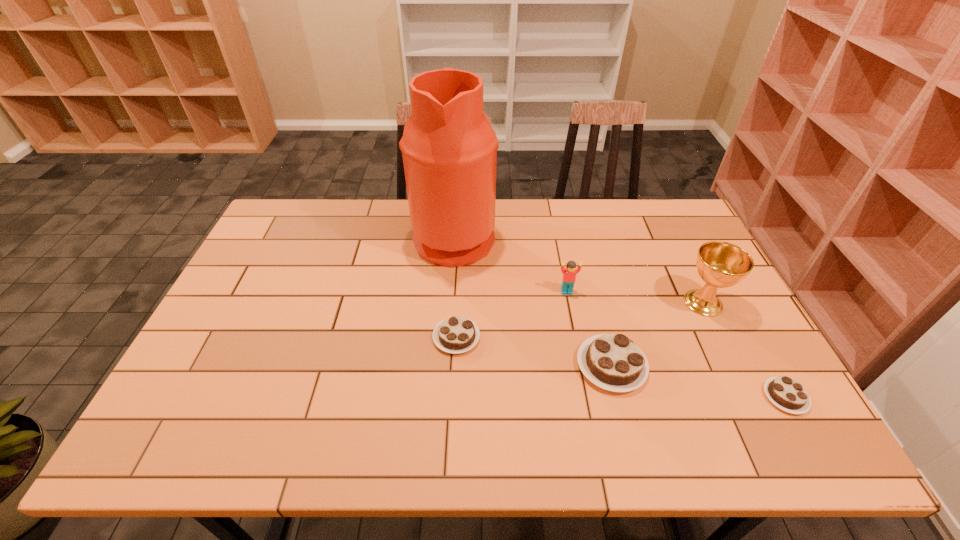
This screenshot has width=960, height=540. In order to click on blank area in the image that satisfies the following two spatial constraints: 1. from the spout of the water jug; 2. on the back side of the fourth tallest object in this screenshot , I will do `click(446, 366)`.

Where is `vacant region that satisfies the following two spatial constraints: 1. from the spout of the farthest object; 2. on the back side of the third shortest object`? vacant region that satisfies the following two spatial constraints: 1. from the spout of the farthest object; 2. on the back side of the third shortest object is located at coordinates (446, 366).

Locate an element on the screen. The height and width of the screenshot is (540, 960). vacant space that satisfies the following two spatial constraints: 1. from the spout of the farthest object; 2. on the left side of the second tallest object is located at coordinates (450, 303).

The width and height of the screenshot is (960, 540). Identify the location of free location that satisfies the following two spatial constraints: 1. from the spout of the second chocolate cake from left to right; 2. on the right side of the farthest object. tap(446, 366).

I want to click on vacant space that satisfies the following two spatial constraints: 1. on the front side of the tallest chocolate cake; 2. on the left side of the second tallest chocolate cake, so click(455, 366).

This screenshot has width=960, height=540. In order to click on free space in the image that satisfies the following two spatial constraints: 1. on the front side of the second chocolate cake from right to left; 2. on the right side of the leftmost chocolate cake in this screenshot , I will do `click(455, 366)`.

Identify the location of free space that satisfies the following two spatial constraints: 1. from the spout of the chalice; 2. on the right side of the water jug. (450, 303).

What are the coordinates of `free region that satisfies the following two spatial constraints: 1. on the face of the rightmost chocolate cake; 2. on the right side of the Lego` in the screenshot? It's located at (588, 397).